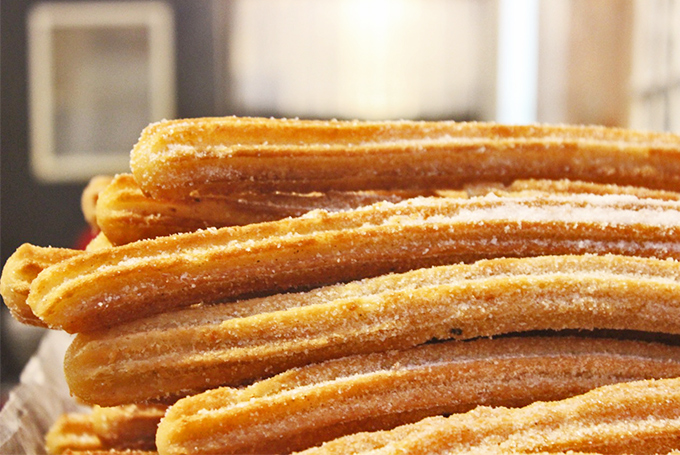
Find the location of a particular element. The width and height of the screenshot is (680, 455). window frame is located at coordinates (666, 85).